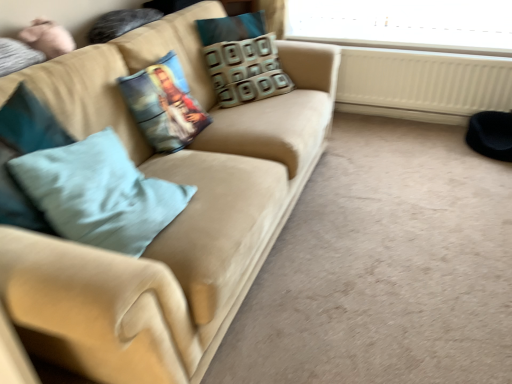
Where is `vacant space in white plastic radiator at lower right (from a real-world perspective)`? The image size is (512, 384). vacant space in white plastic radiator at lower right (from a real-world perspective) is located at coordinates (402, 117).